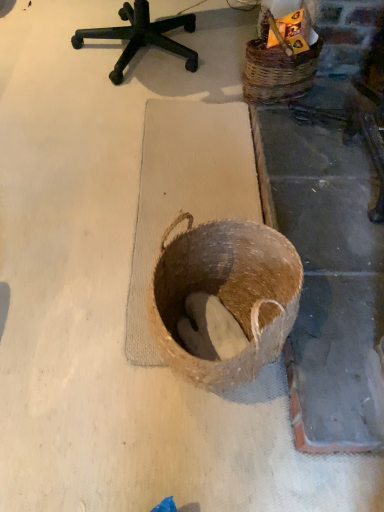
Question: Looking at the image, does brown woven basket at center, the 2th basket from the back, seem bigger or smaller compared to woven brown basket at upper right, which is the second basket from front to back?

Choices:
 (A) small
 (B) big

Answer: (B)

Question: Is brown woven basket at center, which ranks as the 1th basket in bottom-to-top order, inside the boundaries of woven brown basket at upper right, the second basket when ordered from bottom to top, or outside?

Choices:
 (A) inside
 (B) outside

Answer: (B)

Question: Estimate the real-world distances between objects in this image. Which object is closer to the wooden crate at upper right?

Choices:
 (A) brown woven basket at center, the 1th basket in the front-to-back sequence
 (B) woven brown basket at upper right, which ranks as the second basket in left-to-right order

Answer: (B)

Question: Which object is positioned closest to the brown woven basket at center, which is counted as the second basket, starting from the right?

Choices:
 (A) wooden crate at upper right
 (B) woven brown basket at upper right, which ranks as the first basket in back-to-front order

Answer: (B)